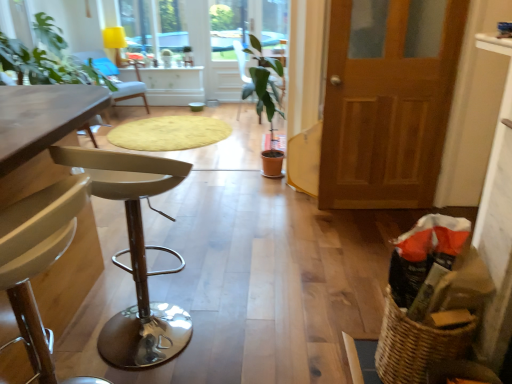
Find the location of a particular element. free space below wooden door at right (from a real-world perspective) is located at coordinates (377, 203).